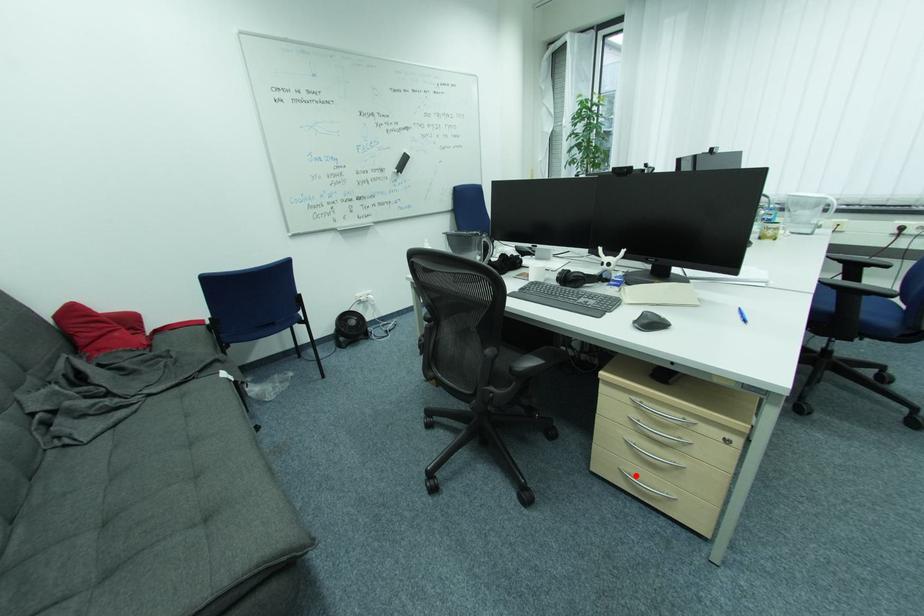
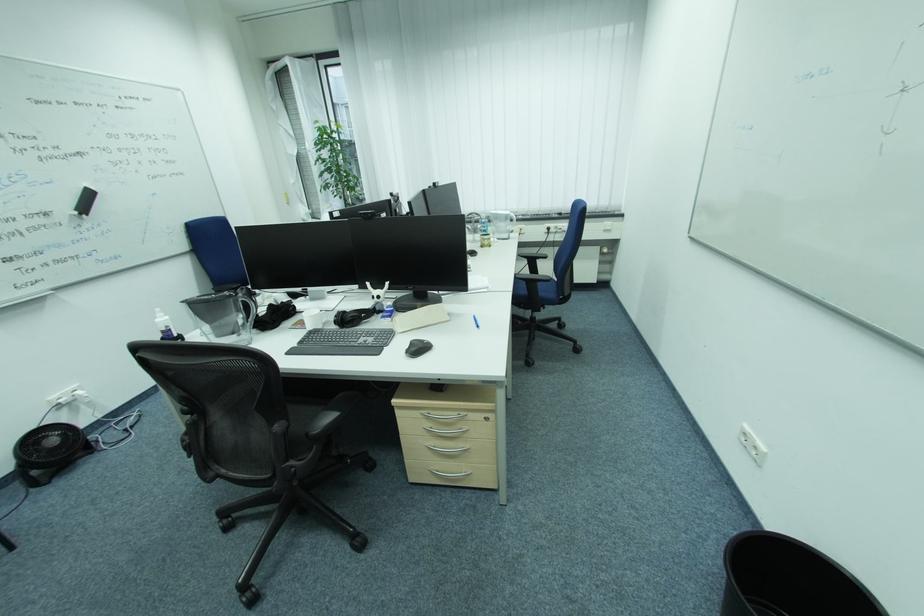
Find the pixel in the second image that matches the highlighted location in the first image.

(444, 472)